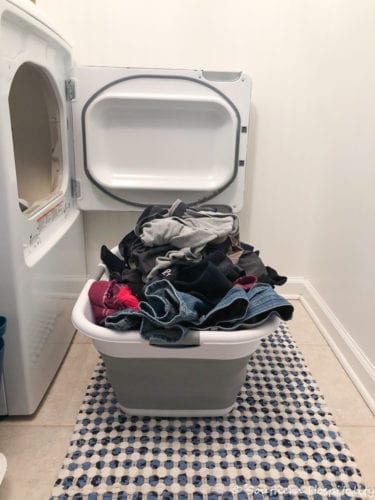
Where is `lint filter`? This screenshot has width=375, height=500. lint filter is located at coordinates (39, 204).